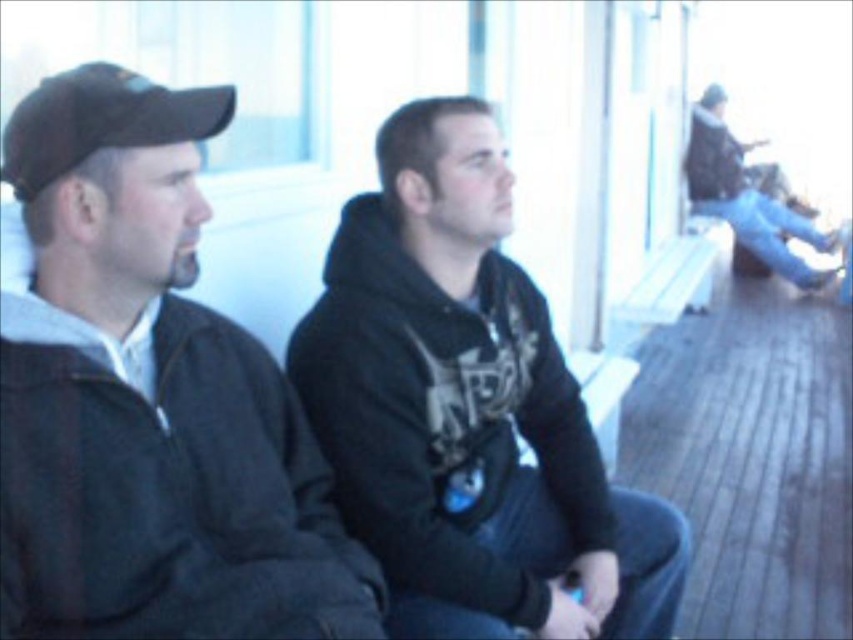
You are standing in the scene and want to place a small flag at the point closer to you between point (x=230, y=401) and point (x=537, y=387). Which point should you choose?

You should choose point (x=230, y=401) because it is closer to the camera than point (x=537, y=387).

You are standing at the entrance of the deck and want to greet both the black matte hoodie at center and the dark gray hoodie at upper right. Which person should you approach first based on their proximity to you?

You should approach the black matte hoodie at center first because it is closer to the viewer than the dark gray hoodie at upper right.

You are a photographer trying to capture a group photo of the dark gray jacket at left and the dark gray hoodie at upper right. Since you want everyone to be visible in the frame, which person should you position closer to the camera to ensure their full height is captured?

The dark gray jacket at left is not as tall as the dark gray hoodie at upper right, so you should position the dark gray jacket at left closer to the camera to ensure their full height is captured.